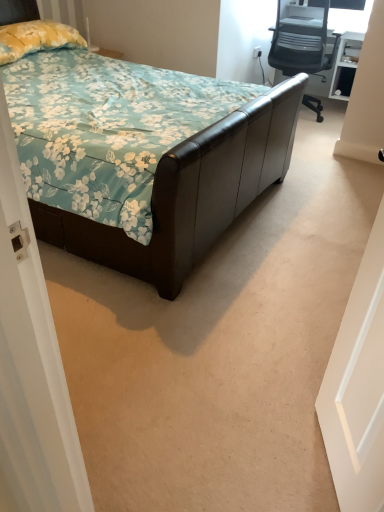
What are the coordinates of `free space to the back side of white matte door at right` in the screenshot? It's located at (278, 384).